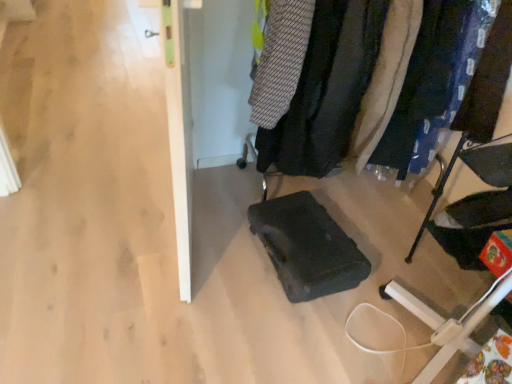
How much space does blue fabric pants at right, which appears as the fourth clothing when viewed from the left, occupy vertically?

It is 30.52 inches.

What do you see at coordinates (461, 331) in the screenshot?
I see `black fabric chair at lower right` at bounding box center [461, 331].

Find the location of a particular element. velvet black coat at center is located at coordinates (325, 89).

Identify the location of knitted fabric sweater at upper right, the second clothing viewed from the left. (326, 89).

Is knitted fabric sweater at upper right, the second clothing viewed from the left, in contact with velvet black coat at center?

Yes, knitted fabric sweater at upper right, the second clothing viewed from the left, is with velvet black coat at center.

Would you say knitted fabric sweater at upper right, arranged as the third clothing when viewed from the right, is outside velvet black coat at center?

No, knitted fabric sweater at upper right, arranged as the third clothing when viewed from the right, is not entirely external to velvet black coat at center.

Is knitted fabric sweater at upper right, the second clothing viewed from the left, at the right side of velvet black coat at center?

No.

In the scene shown: Can you tell me how much knitted fabric sweater at upper right, the second clothing viewed from the left, and velvet black coat at center differ in facing direction?

They differ by 11.4 degrees in their facing directions.

Identify the location of closet located behind the black fabric chair at lower right. (325, 89).

Can you confirm if velvet black coat at center is taller than black fabric chair at lower right?

Indeed, velvet black coat at center has a greater height compared to black fabric chair at lower right.

Is velvet black coat at center with black fabric chair at lower right?

No, velvet black coat at center is not beside black fabric chair at lower right.

Between point (290, 113) and point (454, 155), which one is positioned in front?

The point (290, 113) is closer to the camera.

Looking at their sizes, would you say blue fabric pants at right, which appears as the fourth clothing when viewed from the left, is wider or thinner than knitted fabric sweater at upper center, acting as the first clothing starting from the left?

Clearly, blue fabric pants at right, which appears as the fourth clothing when viewed from the left, has less width compared to knitted fabric sweater at upper center, acting as the first clothing starting from the left.

Is blue fabric pants at right, which is the first clothing in right-to-left order, closer to the viewer compared to knitted fabric sweater at upper center, which ranks as the 4th clothing in right-to-left order?

No, blue fabric pants at right, which is the first clothing in right-to-left order, is further to the viewer.

How distant is blue fabric pants at right, which is the first clothing in right-to-left order, from knitted fabric sweater at upper center, acting as the first clothing starting from the left?

blue fabric pants at right, which is the first clothing in right-to-left order, and knitted fabric sweater at upper center, acting as the first clothing starting from the left, are 22.50 inches apart.

In the image, is knitted fabric sweater at upper center, acting as the first clothing starting from the left, positioned in front of or behind white textured fabric at center right, marked as the 2th clothing in a right-to-left arrangement?

In the image, knitted fabric sweater at upper center, acting as the first clothing starting from the left, appears in front of white textured fabric at center right, marked as the 2th clothing in a right-to-left arrangement.

Does knitted fabric sweater at upper center, which ranks as the 4th clothing in right-to-left order, have a lesser width compared to white textured fabric at center right, marked as the 2th clothing in a right-to-left arrangement?

No, knitted fabric sweater at upper center, which ranks as the 4th clothing in right-to-left order, is not thinner than white textured fabric at center right, marked as the 2th clothing in a right-to-left arrangement.

Is knitted fabric sweater at upper center, acting as the first clothing starting from the left, oriented towards white textured fabric at center right, the 3th clothing from the left?

No, knitted fabric sweater at upper center, acting as the first clothing starting from the left, does not turn towards white textured fabric at center right, the 3th clothing from the left.

How far apart are knitted fabric sweater at upper center, which ranks as the 4th clothing in right-to-left order, and white textured fabric at center right, the 3th clothing from the left?

knitted fabric sweater at upper center, which ranks as the 4th clothing in right-to-left order, and white textured fabric at center right, the 3th clothing from the left, are 15.23 inches apart from each other.

In the image, is knitted fabric sweater at upper center, acting as the first clothing starting from the left, on the left side or the right side of velvet black coat at center?

In the image, knitted fabric sweater at upper center, acting as the first clothing starting from the left, appears on the left side of velvet black coat at center.

From a real-world perspective, is knitted fabric sweater at upper center, acting as the first clothing starting from the left, above or below velvet black coat at center?

From a real-world perspective, knitted fabric sweater at upper center, acting as the first clothing starting from the left, is physically above velvet black coat at center.

From a real-world perspective, count 4th clothings upward from the velvet black coat at center and point to it. Please provide its 2D coordinates.

[(280, 60)]

In the scene shown: Is knitted fabric sweater at upper center, acting as the first clothing starting from the left, bigger or smaller than velvet black coat at center?

In the image, knitted fabric sweater at upper center, acting as the first clothing starting from the left, appears to be smaller than velvet black coat at center.

Based on the photo, is white textured fabric at center right, the 3th clothing from the left, taller or shorter than blue fabric pants at right, which appears as the fourth clothing when viewed from the left?

In the image, white textured fabric at center right, the 3th clothing from the left, appears to be taller than blue fabric pants at right, which appears as the fourth clothing when viewed from the left.

Is the position of white textured fabric at center right, the 3th clothing from the left, more distant than that of blue fabric pants at right, which is the first clothing in right-to-left order?

That is False.

Is white textured fabric at center right, marked as the 2th clothing in a right-to-left arrangement, positioned with its back to blue fabric pants at right, which is the first clothing in right-to-left order?

No, white textured fabric at center right, marked as the 2th clothing in a right-to-left arrangement, is not facing away from blue fabric pants at right, which is the first clothing in right-to-left order.

Which of these two, white textured fabric at center right, the 3th clothing from the left, or blue fabric pants at right, which appears as the fourth clothing when viewed from the left, is wider?

white textured fabric at center right, the 3th clothing from the left.

How distant is white textured fabric at center right, the 3th clothing from the left, from knitted fabric sweater at upper right, arranged as the third clothing when viewed from the right?

white textured fabric at center right, the 3th clothing from the left, is 5.81 inches away from knitted fabric sweater at upper right, arranged as the third clothing when viewed from the right.

Which of these two, white textured fabric at center right, marked as the 2th clothing in a right-to-left arrangement, or knitted fabric sweater at upper right, the second clothing viewed from the left, is thinner?

Thinner between the two is white textured fabric at center right, marked as the 2th clothing in a right-to-left arrangement.

Would you say knitted fabric sweater at upper right, arranged as the third clothing when viewed from the right, is part of white textured fabric at center right, the 3th clothing from the left,'s contents?

No, knitted fabric sweater at upper right, arranged as the third clothing when viewed from the right, is not inside white textured fabric at center right, the 3th clothing from the left.

From the image's perspective, which one is positioned higher, white textured fabric at center right, marked as the 2th clothing in a right-to-left arrangement, or knitted fabric sweater at upper right, the second clothing viewed from the left?

From the image's view, knitted fabric sweater at upper right, the second clothing viewed from the left, is above.

Where is `closet that is behind the knitted fabric sweater at upper right, the second clothing viewed from the left`? closet that is behind the knitted fabric sweater at upper right, the second clothing viewed from the left is located at coordinates (325, 89).

Find the location of a particular element. The width and height of the screenshot is (512, 384). furniture below the velvet black coat at center (from the image's perspective) is located at coordinates (461, 331).

Based on their spatial positions, is velvet black coat at center or black fabric chair at lower right closer to blue fabric pants at right, which appears as the fourth clothing when viewed from the left?

velvet black coat at center.

Estimate the real-world distances between objects in this image. Which object is further from black fabric chair at lower right, knitted fabric sweater at upper center, which ranks as the 4th clothing in right-to-left order, or white textured fabric at center right, marked as the 2th clothing in a right-to-left arrangement?

knitted fabric sweater at upper center, which ranks as the 4th clothing in right-to-left order, lies further to black fabric chair at lower right than the other object.

Based on their spatial positions, is knitted fabric sweater at upper center, acting as the first clothing starting from the left, or velvet black coat at center closer to blue fabric pants at right, which is the first clothing in right-to-left order?

velvet black coat at center is positioned closer to the anchor blue fabric pants at right, which is the first clothing in right-to-left order.

Considering their positions, is velvet black coat at center positioned further to knitted fabric sweater at upper center, acting as the first clothing starting from the left, than blue fabric pants at right, which is the first clothing in right-to-left order?

blue fabric pants at right, which is the first clothing in right-to-left order, is further to knitted fabric sweater at upper center, acting as the first clothing starting from the left.

Which object lies nearer to the anchor point knitted fabric sweater at upper right, the second clothing viewed from the left, blue fabric pants at right, which appears as the fourth clothing when viewed from the left, or black fabric chair at lower right?

The object closer to knitted fabric sweater at upper right, the second clothing viewed from the left, is blue fabric pants at right, which appears as the fourth clothing when viewed from the left.

Estimate the real-world distances between objects in this image. Which object is further from knitted fabric sweater at upper center, acting as the first clothing starting from the left, white textured fabric at center right, the 3th clothing from the left, or blue fabric pants at right, which is the first clothing in right-to-left order?

blue fabric pants at right, which is the first clothing in right-to-left order.

Based on their spatial positions, is black fabric chair at lower right or blue fabric pants at right, which is the first clothing in right-to-left order, closer to knitted fabric sweater at upper center, acting as the first clothing starting from the left?

Among the two, blue fabric pants at right, which is the first clothing in right-to-left order, is located nearer to knitted fabric sweater at upper center, acting as the first clothing starting from the left.

Which object lies further to the anchor point knitted fabric sweater at upper right, arranged as the third clothing when viewed from the right, blue fabric pants at right, which appears as the fourth clothing when viewed from the left, or knitted fabric sweater at upper center, which ranks as the 4th clothing in right-to-left order?

The object further to knitted fabric sweater at upper right, arranged as the third clothing when viewed from the right, is blue fabric pants at right, which appears as the fourth clothing when viewed from the left.

What are the coordinates of `clothing located between velvet black coat at center and blue fabric pants at right, which appears as the fourth clothing when viewed from the left, in the left-right direction` in the screenshot? It's located at (386, 78).

Identify the location of clothing that lies between blue fabric pants at right, which is the first clothing in right-to-left order, and black fabric chair at lower right from top to bottom. (386, 78).

Locate an element on the screen. This screenshot has height=384, width=512. closet between white textured fabric at center right, marked as the 2th clothing in a right-to-left arrangement, and black fabric chair at lower right vertically is located at coordinates (325, 89).

I want to click on closet between blue fabric pants at right, which is the first clothing in right-to-left order, and black fabric chair at lower right, in the vertical direction, so click(x=325, y=89).